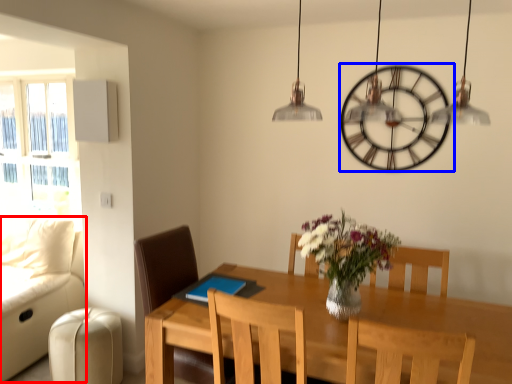
Question: Which point is closer to the camera, couch (highlighted by a red box) or wall clock (highlighted by a blue box)?

Choices:
 (A) couch
 (B) wall clock

Answer: (A)